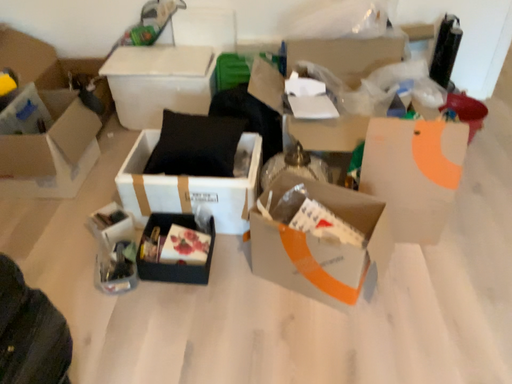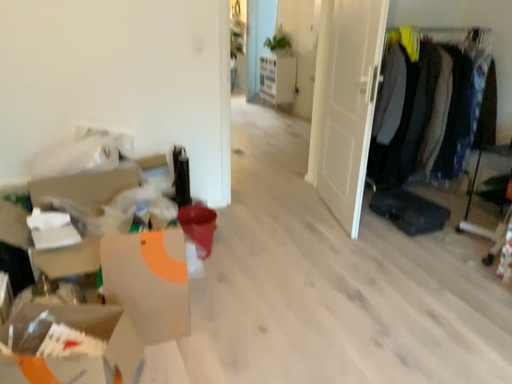
Question: How did the camera likely rotate when shooting the video?

Choices:
 (A) rotated right
 (B) rotated left

Answer: (A)